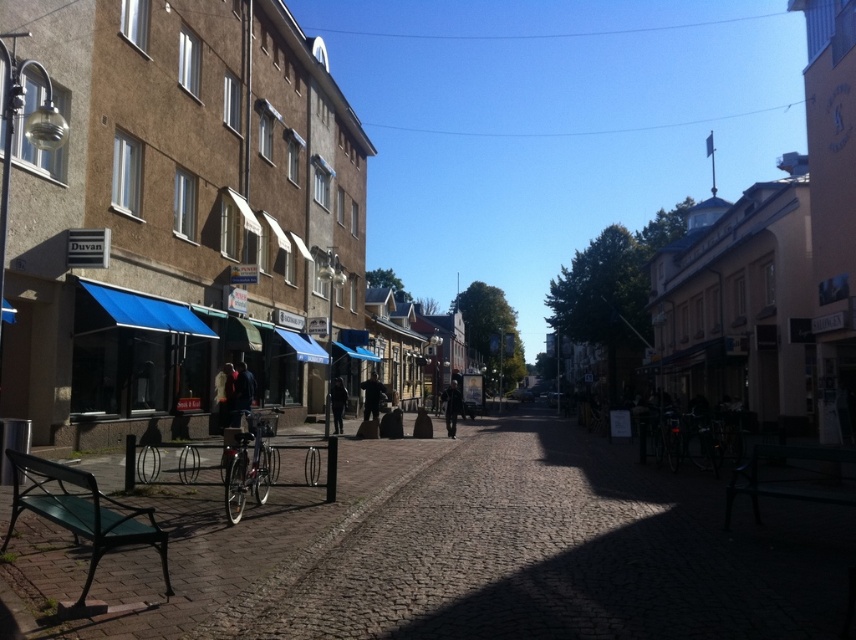
Measure the distance between point (366,380) and camera.

Point (366,380) is 125.59 feet from camera.

Is point (370, 404) farther from viewer compared to point (450, 436)?

No, (370, 404) is in front of (450, 436).

The height and width of the screenshot is (640, 856). I want to click on dark brown leather jacket at center, so click(x=372, y=396).

Where is `dark brown leather jacket at center`? dark brown leather jacket at center is located at coordinates (372, 396).

Is dark blue jacket at center to the left of black matte jacket at center from the viewer's perspective?

Indeed, dark blue jacket at center is positioned on the left side of black matte jacket at center.

Is dark blue jacket at center smaller than black matte jacket at center?

Yes, dark blue jacket at center is smaller than black matte jacket at center.

Does point (251, 394) come closer to viewer compared to point (459, 390)?

Yes, point (251, 394) is closer to viewer.

What are the coordinates of `dark blue jacket at center` in the screenshot? It's located at (242, 388).

Is black matte jacket at center positioned in front of dark blue jeans at center?

No, black matte jacket at center is further to the viewer.

Between point (447, 433) and point (336, 406), which one is positioned in front?

Positioned in front is point (336, 406).

Between point (446, 428) and point (336, 401), which one is positioned in front?

Positioned in front is point (336, 401).

At what (x,y) coordinates should I click in order to perform the action: click on black matte jacket at center. Please return your answer as a coordinate pair (x, y). Looking at the image, I should click on (450, 406).